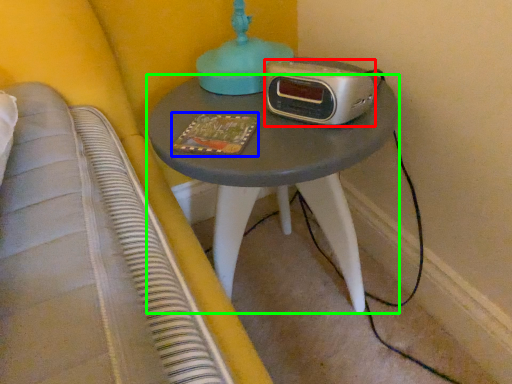
Question: Which is nearer to the stereo (highlighted by a red box)? book (highlighted by a blue box) or nightstand (highlighted by a green box).

Choices:
 (A) book
 (B) nightstand

Answer: (A)